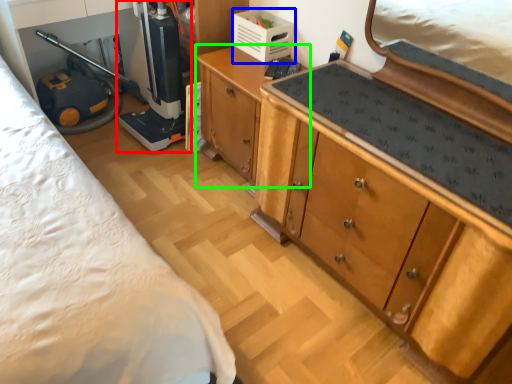
Question: Which object is positioned closest to appliance (highlighted by a red box)? Select from appliance (highlighted by a blue box) and cabinetry (highlighted by a green box).

Choices:
 (A) appliance
 (B) cabinetry

Answer: (B)